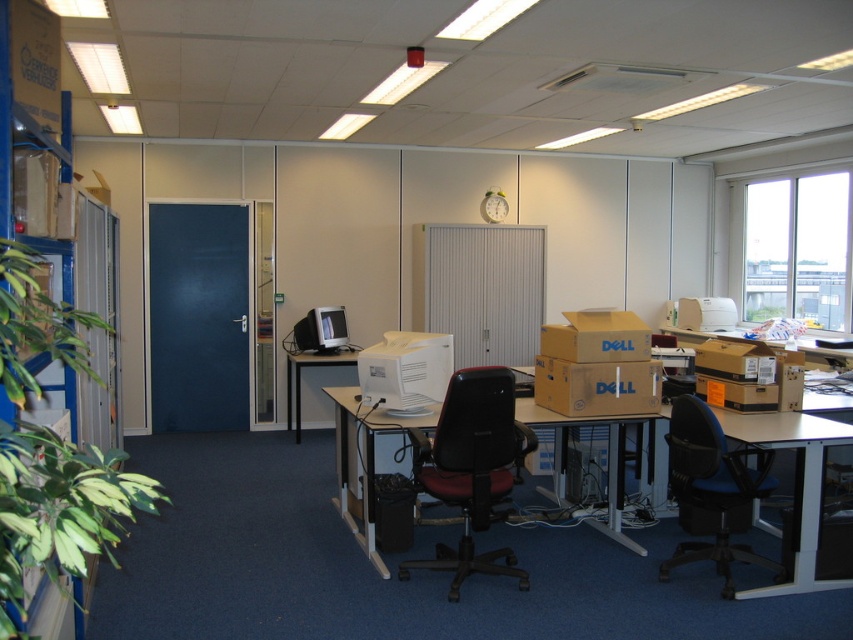
Question: Is black leather swivel chair at center smaller than white plastic clock at upper center?

Choices:
 (A) no
 (B) yes

Answer: (A)

Question: Which object is the farthest from the black plastic table at center?

Choices:
 (A) matte white desk at center
 (B) matte black monitor at center left
 (C) brown cardboard box at center

Answer: (C)

Question: Which of the following is the farthest from the observer?

Choices:
 (A) white plastic clock at upper center
 (B) black leather swivel chair at center
 (C) green leafy plant at left
 (D) matte white desk at center

Answer: (A)

Question: In this image, where is matte white desk at center located relative to matte black monitor at center left?

Choices:
 (A) below
 (B) above

Answer: (A)

Question: Can you confirm if green leafy plant at left is wider than blue fabric swivel chair at right?

Choices:
 (A) yes
 (B) no

Answer: (A)

Question: Which of the following is the farthest from the observer?

Choices:
 (A) brown cardboard box at center
 (B) matte white desk at center
 (C) black plastic table at center

Answer: (C)